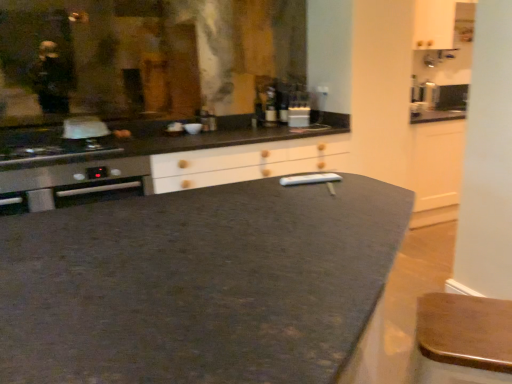
Question: Considering the relative positions of matte glass bottle at center, the 2th bottle positioned from the left, and wooden bar stool at lower right in the image provided, is matte glass bottle at center, the 2th bottle positioned from the left, to the left of wooden bar stool at lower right from the viewer's perspective?

Choices:
 (A) yes
 (B) no

Answer: (A)

Question: Considering the relative sizes of matte glass bottle at center, placed as the first bottle when sorted from right to left, and wooden bar stool at lower right in the image provided, is matte glass bottle at center, placed as the first bottle when sorted from right to left, bigger than wooden bar stool at lower right?

Choices:
 (A) yes
 (B) no

Answer: (B)

Question: Is matte glass bottle at center, placed as the first bottle when sorted from right to left, oriented away from wooden bar stool at lower right?

Choices:
 (A) yes
 (B) no

Answer: (B)

Question: Is matte glass bottle at center, placed as the first bottle when sorted from right to left, oriented towards wooden bar stool at lower right?

Choices:
 (A) no
 (B) yes

Answer: (A)

Question: From a real-world perspective, is matte glass bottle at center, placed as the first bottle when sorted from right to left, positioned under wooden bar stool at lower right based on gravity?

Choices:
 (A) no
 (B) yes

Answer: (A)

Question: Considering the relative positions of dark granite countertop at center and matte glass bottle at center, the first bottle when ordered from left to right, in the image provided, is dark granite countertop at center to the left or to the right of matte glass bottle at center, the first bottle when ordered from left to right,?

Choices:
 (A) left
 (B) right

Answer: (A)

Question: In terms of height, does dark granite countertop at center look taller or shorter compared to matte glass bottle at center, marked as the second bottle in a right-to-left arrangement?

Choices:
 (A) tall
 (B) short

Answer: (A)

Question: Considering the positions of dark granite countertop at center and matte glass bottle at center, the first bottle when ordered from left to right, in the image, is dark granite countertop at center bigger or smaller than matte glass bottle at center, the first bottle when ordered from left to right,?

Choices:
 (A) big
 (B) small

Answer: (A)

Question: In terms of width, does dark granite countertop at center look wider or thinner when compared to matte glass bottle at center, marked as the second bottle in a right-to-left arrangement?

Choices:
 (A) thin
 (B) wide

Answer: (B)

Question: In terms of width, does matte glass bottle at center, the 2th bottle positioned from the left, look wider or thinner when compared to stainless steel oven at left?

Choices:
 (A) thin
 (B) wide

Answer: (A)

Question: In the image, is matte glass bottle at center, placed as the first bottle when sorted from right to left, positioned in front of or behind stainless steel oven at left?

Choices:
 (A) front
 (B) behind

Answer: (B)

Question: Which is correct: matte glass bottle at center, the 2th bottle positioned from the left, is inside stainless steel oven at left, or outside of it?

Choices:
 (A) inside
 (B) outside

Answer: (B)

Question: Is matte glass bottle at center, placed as the first bottle when sorted from right to left, to the left or to the right of stainless steel oven at left in the image?

Choices:
 (A) left
 (B) right

Answer: (B)

Question: From a real-world perspective, is dark granite countertop at center positioned above or below wooden bar stool at lower right?

Choices:
 (A) above
 (B) below

Answer: (B)

Question: Is dark granite countertop at center bigger or smaller than wooden bar stool at lower right?

Choices:
 (A) big
 (B) small

Answer: (A)